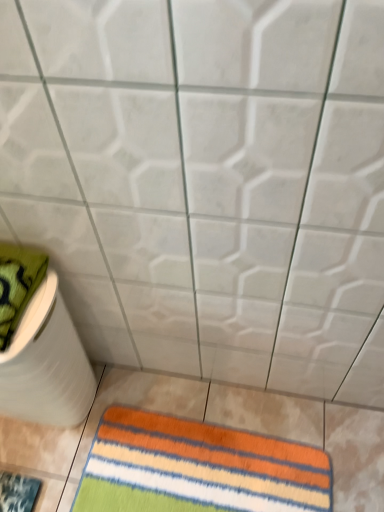
Question: Looking at their shapes, would you say green textured towel at left is wider or thinner than white matte toilet paper at lower left?

Choices:
 (A) thin
 (B) wide

Answer: (B)

Question: Is point (28, 294) positioned closer to the camera than point (56, 315)?

Choices:
 (A) farther
 (B) closer

Answer: (B)

Question: Which object is positioned farthest from the multicolored striped rug at lower left?

Choices:
 (A) green textured towel at left
 (B) white matte toilet paper at lower left
 (C) multicolored striped rug at lower center

Answer: (A)

Question: Which is nearer to the white matte toilet paper at lower left?

Choices:
 (A) multicolored striped rug at lower center
 (B) green textured towel at left
 (C) multicolored striped rug at lower left

Answer: (B)